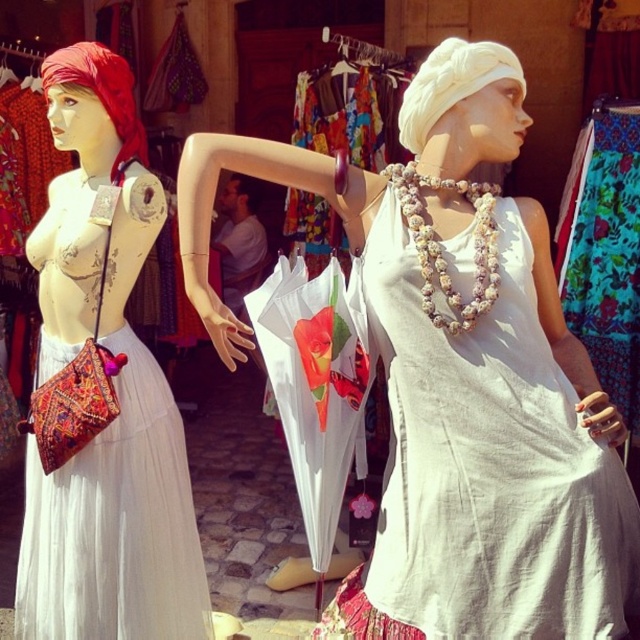
Question: Can you confirm if pearl-like beads necklace at center is positioned to the left of red satin headscarf at left?

Choices:
 (A) no
 (B) yes

Answer: (A)

Question: Which object is farther from the camera taking this photo?

Choices:
 (A) matte white dress at left
 (B) white fabric dress at center

Answer: (A)

Question: Which of the following is the farthest from the observer?

Choices:
 (A) (426, 84)
 (B) (81, 579)
 (C) (554, 432)

Answer: (B)

Question: Which object is the closest to the white fabric dress at center?

Choices:
 (A) red satin headscarf at left
 (B) matte white dress at left
 (C) white fabric headscarf at upper center

Answer: (C)

Question: Can you confirm if white fabric dress at center is smaller than matte white dress at left?

Choices:
 (A) yes
 (B) no

Answer: (B)

Question: From the image, what is the correct spatial relationship of matte white dress at left in relation to white fabric headscarf at upper center?

Choices:
 (A) above
 (B) below

Answer: (B)